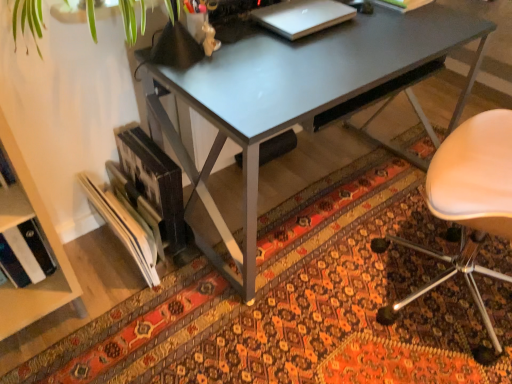
Identify the location of free location to the left of beige leather chair at right. This screenshot has width=512, height=384. (317, 313).